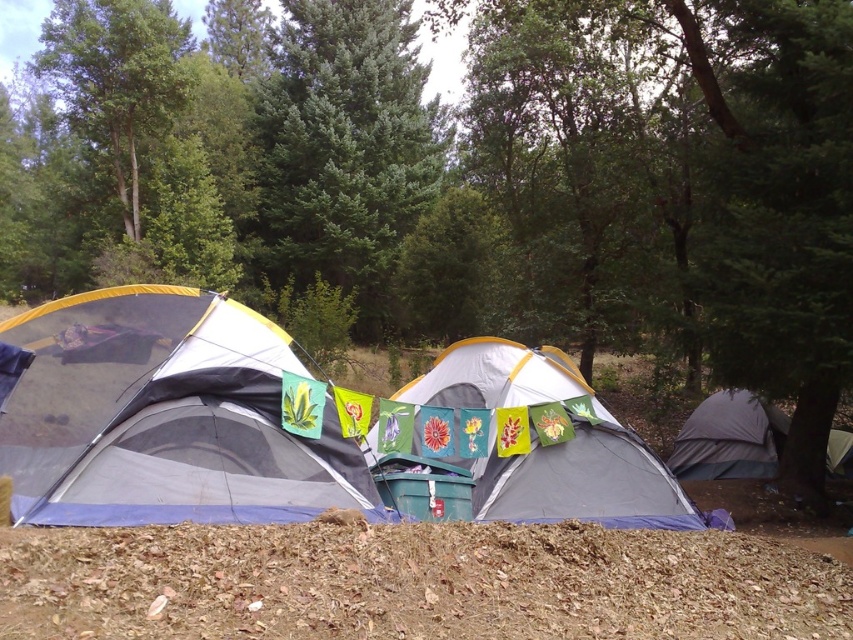
You are a camper who wants to set up a satellite dish. The dish requires a clear line of sight to the sky. Given the gray fabric tent at center and the green leafy tree at upper left, which object is shorter and thus less likely to block the satellite dish?

The gray fabric tent at center is shorter than the green leafy tree at upper left, so it is less likely to block the satellite dish.

What are the coordinates of the green fir tree at center?

The green fir tree at center is located at coordinates point (345, 148).